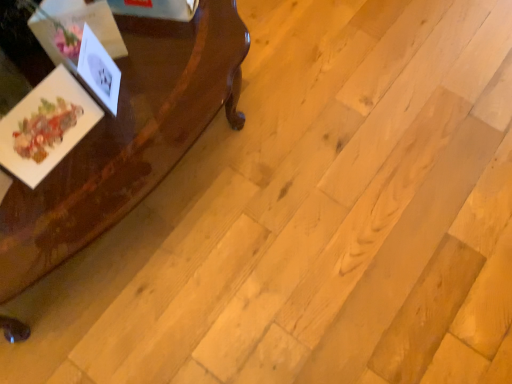
Question: In the image, is white paper at left, which appears as the 1th postcard when viewed from the right, positioned in front of or behind glossy wood table at left?

Choices:
 (A) front
 (B) behind

Answer: (B)

Question: In terms of width, does white paper at left, which appears as the 1th postcard when viewed from the right, look wider or thinner when compared to glossy wood table at left?

Choices:
 (A) wide
 (B) thin

Answer: (B)

Question: Based on their relative distances, which object is farther from the white paper at left, which appears as the 1th postcard when viewed from the right?

Choices:
 (A) glossy wood table at left
 (B) matte paper postcard at left, the 1th postcard in the left-to-right sequence

Answer: (A)

Question: Which object is the closest to the glossy wood table at left?

Choices:
 (A) matte paper postcard at left, the 1th postcard in the left-to-right sequence
 (B) white paper at left, which appears as the 2th postcard when viewed from the left

Answer: (A)